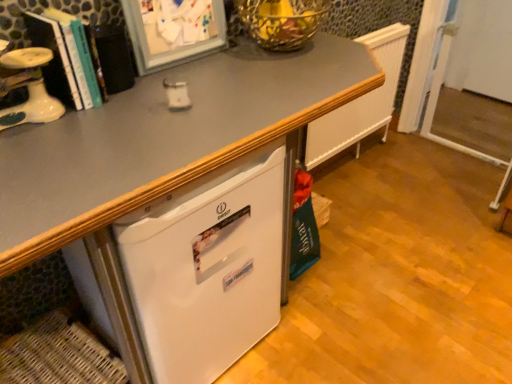
I want to click on vacant area that lies to the right of hardcover book at left, so click(x=139, y=97).